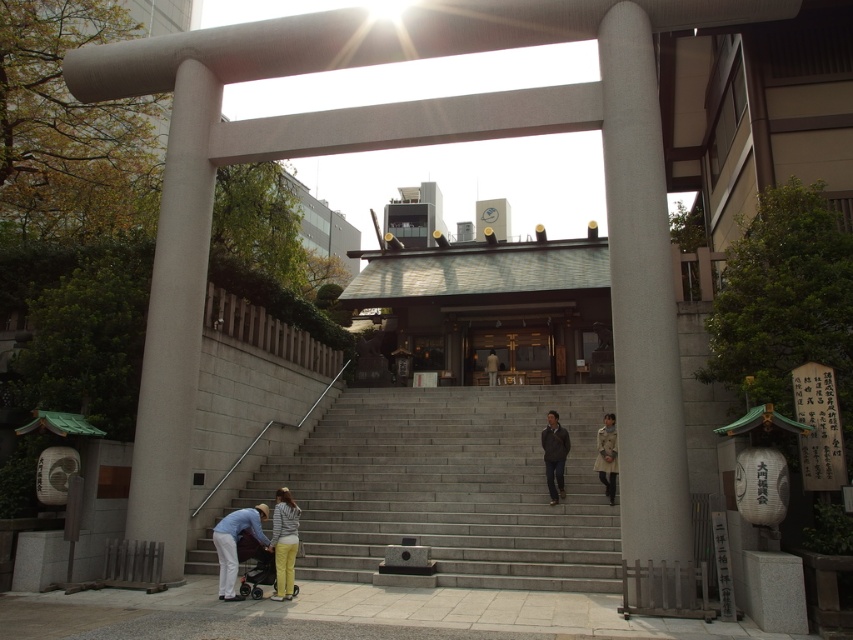
Who is more forward, (x=561, y=417) or (x=286, y=580)?

Point (x=286, y=580)

What do you see at coordinates (451, 486) in the screenshot? I see `gray concrete stairs at center` at bounding box center [451, 486].

What do you see at coordinates (451, 486) in the screenshot? This screenshot has height=640, width=853. I see `gray concrete stairs at center` at bounding box center [451, 486].

Identify the location of gray concrete stairs at center. (451, 486).

Who is positioned more to the left, gray concrete stairs at center or dark gray jacket at center?

gray concrete stairs at center

Which is below, gray concrete stairs at center or dark gray jacket at center?

gray concrete stairs at center is lower down.

I want to click on gray concrete stairs at center, so click(451, 486).

Between light blue fabric stroller at lower center and light brown leather jacket at center, which one has less height?

light brown leather jacket at center

Between light blue fabric stroller at lower center and light brown leather jacket at center, which one is positioned lower?

light blue fabric stroller at lower center is below.

Is point (277, 593) positioned behind point (490, 380)?

No, it is not.

Image resolution: width=853 pixels, height=640 pixels. What are the coordinates of `light blue fabric stroller at lower center` in the screenshot? It's located at (253, 540).